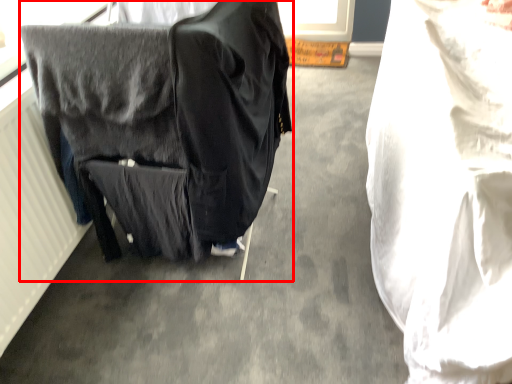
Question: From the image, what is the correct spatial relationship of furniture (annotated by the red box) in relation to sheet?

Choices:
 (A) right
 (B) left

Answer: (B)